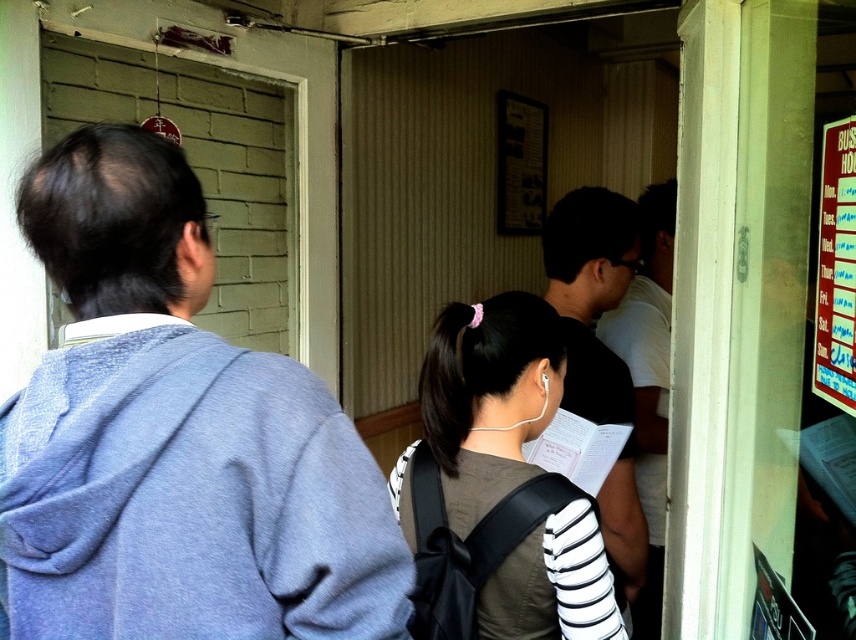
Question: Can you confirm if black matte shirt at center is positioned to the right of red plastic signboard at right?

Choices:
 (A) no
 (B) yes

Answer: (A)

Question: Which object appears farthest from the camera in this image?

Choices:
 (A) dark brown hair at center
 (B) black matte shirt at center

Answer: (B)

Question: Which of the following is the farthest from the observer?

Choices:
 (A) black matte shirt at center
 (B) red plastic signboard at right

Answer: (A)

Question: Which object is positioned closest to the dark gray shirt at center?

Choices:
 (A) light blue hoodie at left
 (B) black matte shirt at center
 (C) red plastic signboard at right

Answer: (B)

Question: Is light blue hoodie at left closer to the viewer compared to black matte shirt at center?

Choices:
 (A) no
 (B) yes

Answer: (B)

Question: Does light blue hoodie at left have a smaller size compared to black matte shirt at center?

Choices:
 (A) no
 (B) yes

Answer: (B)